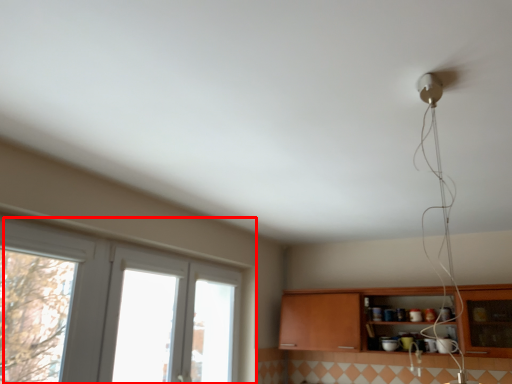
Question: From the image's perspective, where is window (annotated by the red box) located in relation to cabinetry in the image?

Choices:
 (A) above
 (B) below

Answer: (A)